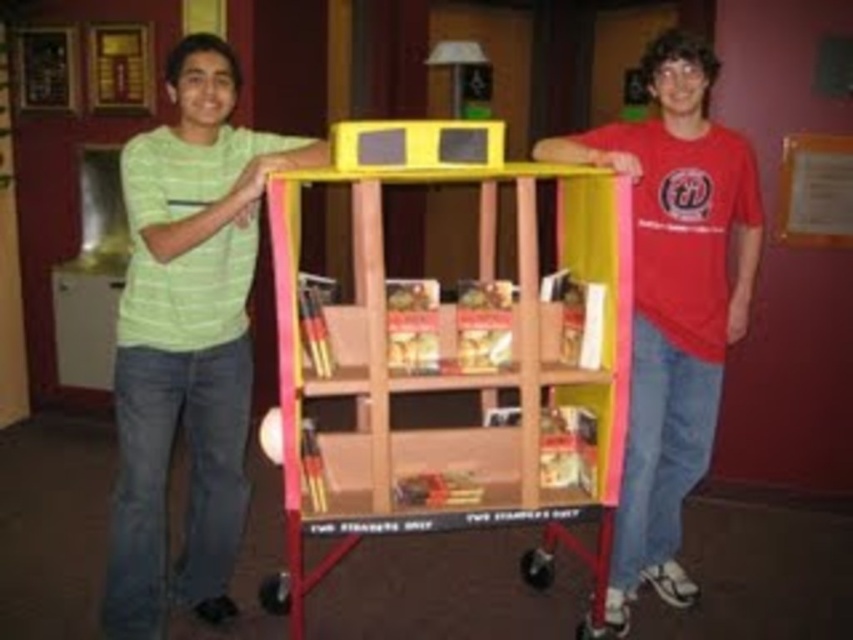
You are standing in a room with a wooden bookshelf at center. If you face the bookshelf and look directly ahead, which direction would you be facing relative to the room?

Since the wooden bookshelf at center is located at coordinates approximately 0.595 on the x and 0.531 on the y axis, it is centrally positioned in the room. Facing the bookshelf would mean you are facing towards the center of the room.

You are standing in front of the wooden bookshelf at center and want to greet the person wearing the green striped shirt at left. In which direction should you move to face them?

The wooden bookshelf at center is positioned under the green striped shirt at left, so you should move to your left to face them.